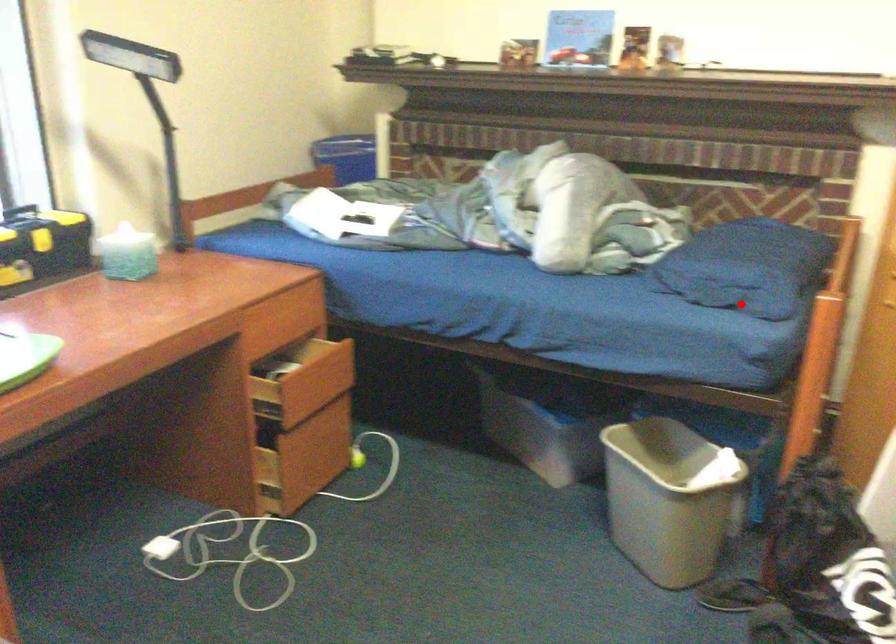
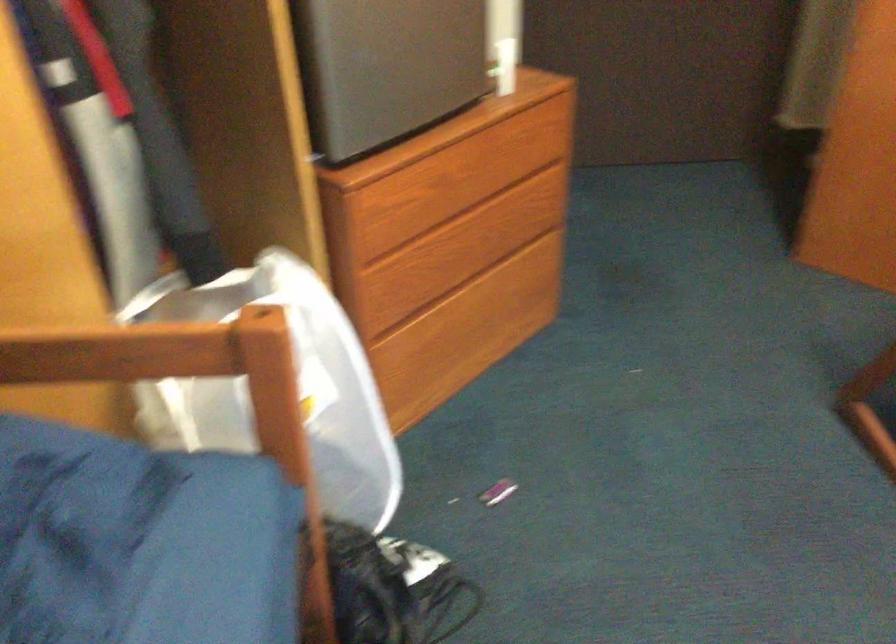
Locate, in the second image, the point that corresponds to the highlighted location in the first image.

(73, 529)